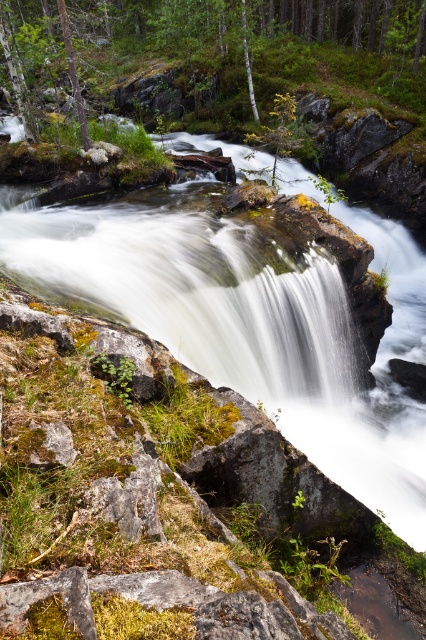
You are a hiker carrying a backpack and need to cross from the green mossy rock at upper center to the white smooth water at center. The path between them is narrow. Can you safely walk the 11.43 meters between them without slipping?

The distance between the green mossy rock at upper center and white smooth water at center is 11.43 meters. Since the path is narrow and the rocks are rugged with moss, there is a risk of slipping. It is advisable to proceed with caution or find a safer route.

In the scene shown: You are standing at the base of the waterfall and want to place a small decorative rock. You have two options for placement locations marked as point coordinates. The first is at point (405, 305) and the second is at point (244, 22). Which point is closer to you so that the decorative rock will be more visible to visitors approaching from the front?

Point (405, 305) is closer to the viewer than point (244, 22), so placing the decorative rock there would make it more visible to visitors approaching from the front.